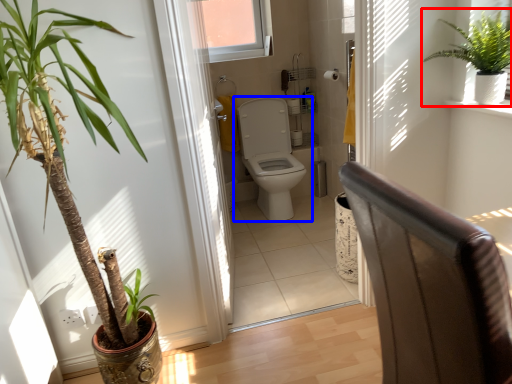
Question: Which point is further to the camera, houseplant (highlighted by a red box) or toilet (highlighted by a blue box)?

Choices:
 (A) houseplant
 (B) toilet

Answer: (B)